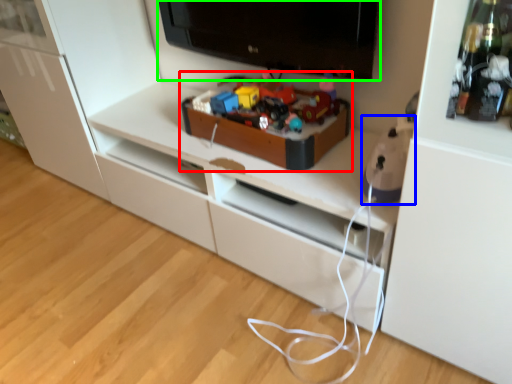
Question: Based on their relative distances, which object is farther from toy (highlighted by a red box)? Choose from toy (highlighted by a blue box) and television (highlighted by a green box).

Choices:
 (A) toy
 (B) television

Answer: (A)